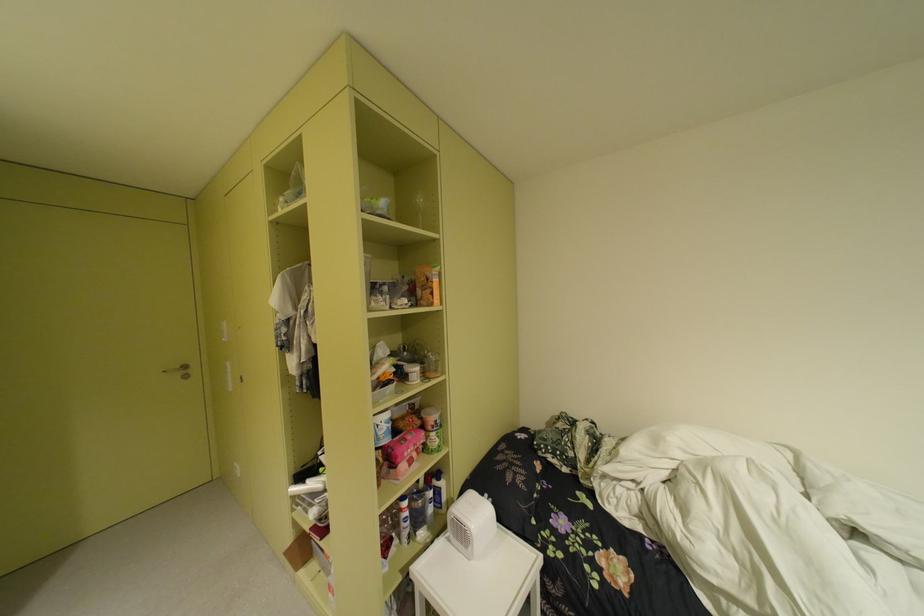
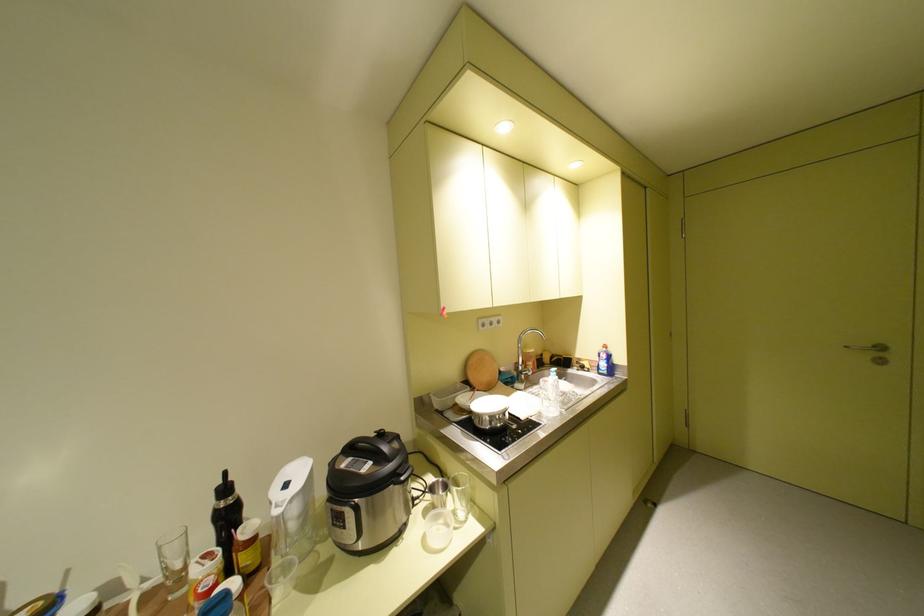
Question: The first image is from the beginning of the video and the second image is from the end. How did the camera likely rotate when shooting the video?

Choices:
 (A) Left
 (B) Right
 (C) Up
 (D) Down

Answer: (A)